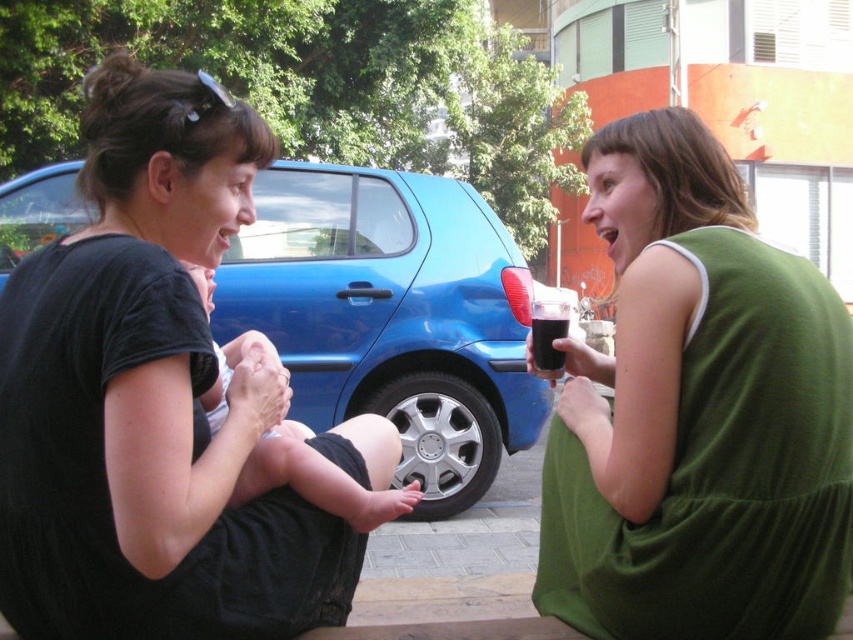
Which is more to the right, green fabric dress at center or blue metallic car at center?

From the viewer's perspective, green fabric dress at center appears more on the right side.

Which is in front, point (672, 636) or point (515, 448)?

Point (672, 636)

You are a GUI agent. You are given a task and a screenshot of the screen. Output one action in this format:
    pyautogui.click(x=<x>, y=<y>)
    Task: Click on the green fabric dress at center
    The height and width of the screenshot is (640, 853).
    Given the screenshot: What is the action you would take?
    pyautogui.click(x=697, y=413)

Measure the distance from green fabric dress at center to soft skin baby at center.

The distance of green fabric dress at center from soft skin baby at center is 22.43 inches.

This screenshot has width=853, height=640. Identify the location of green fabric dress at center. (697, 413).

Locate an element on the screen. Image resolution: width=853 pixels, height=640 pixels. green fabric dress at center is located at coordinates 697,413.

Can you confirm if blue metallic car at center is positioned to the left of soft skin baby at center?

In fact, blue metallic car at center is to the right of soft skin baby at center.

At what (x,y) coordinates should I click in order to perform the action: click on blue metallic car at center. Please return your answer as a coordinate pair (x, y). This screenshot has width=853, height=640. Looking at the image, I should click on click(392, 316).